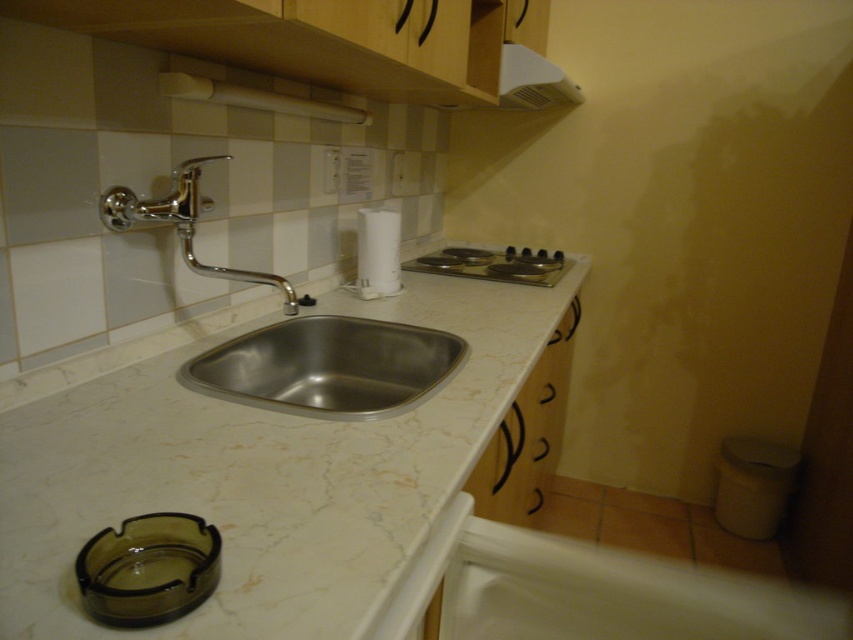
You are standing in the kitchen and notice two points marked on the wall. The first point is at coordinate point (474, 406) and the second is at point (218, 392). Which point is closer to your current position?

Point (474, 406) is closer to the camera than point (218, 392), so the first point is closer to your current position.